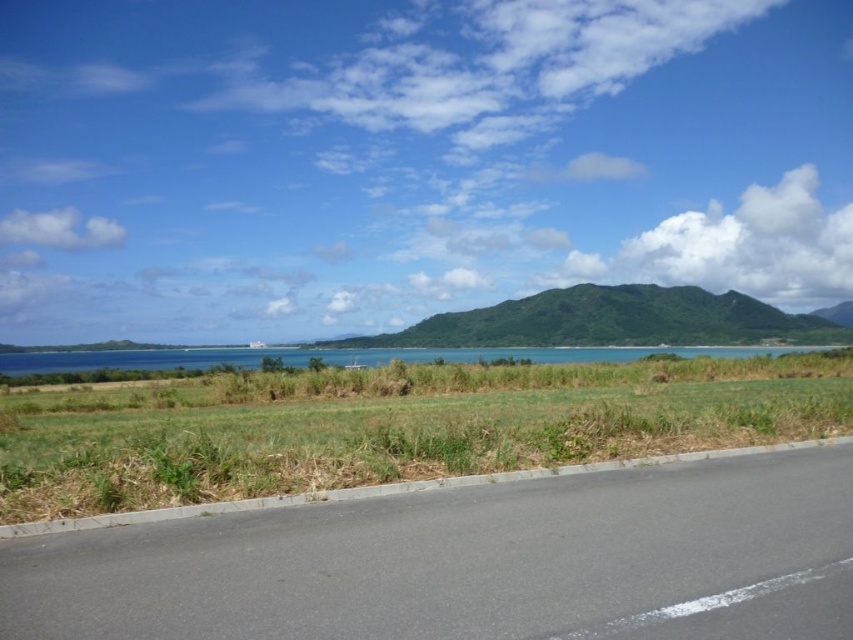
You are a drone operator planning to take aerial photos of the black asphalt highway at lower center and the blue water at center. Which object will appear smaller in the photo if the drone is flying at the same altitude and zoom level for both shots?

The black asphalt highway at lower center will appear smaller in the photo because it has a lesser height compared to the blue water at center.

You are standing at the point where the white dashed line ends on the road. Looking towards the black asphalt highway at lower center, which is located at point [469,563], can you see the body of water in the middle ground?

Yes, the black asphalt highway at lower center is located at point [469,563], so the body of water in the middle ground is visible beyond the highway.

You are standing at the edge of the paved road and want to take a photo of the green textured mountain at center. If your camera has a maximum focus range of 80 meters, will it be able to capture the mountain clearly?

The green textured mountain at center and camera are 82.71 meters apart, which exceeds the camera maximum focus range of 80 meters. Therefore, the camera cannot capture the mountain clearly.